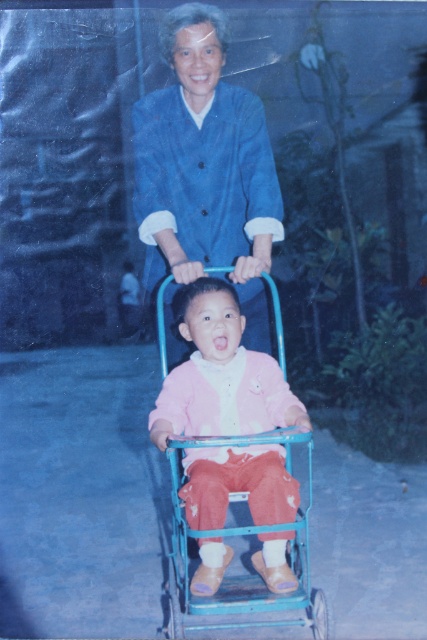
Looking at this image, you are a photographer trying to capture a photo of the blue cotton jacket at upper center and the pink fleece jacket at center. Which jacket is covering part of the other?

The blue cotton jacket at upper center is positioned over the pink fleece jacket at center, so it is covering part of it.